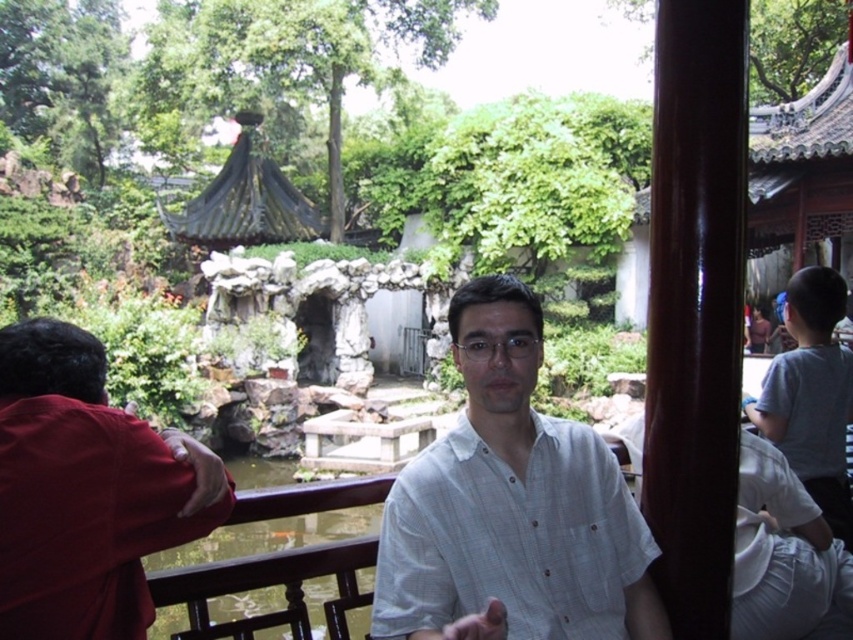
Does point (392, 563) lie in front of point (838, 448)?

Yes, point (392, 563) is closer to viewer.

Is white textured shirt at center to the right of gray cotton shirt at right from the viewer's perspective?

In fact, white textured shirt at center is to the left of gray cotton shirt at right.

The image size is (853, 640). Find the location of `white textured shirt at center`. white textured shirt at center is located at coordinates point(511,506).

Does point (277, 490) come behind point (209, 230)?

No, it is in front of (209, 230).

Measure the distance from transparent glass pond at center to dark gray stone gazebo at upper left.

transparent glass pond at center and dark gray stone gazebo at upper left are 44.15 meters apart.

Identify the location of transparent glass pond at center. click(x=267, y=586).

Can you confirm if gray cotton shirt at right is taller than dark gray stone gazebo at upper left?

Incorrect, gray cotton shirt at right's height is not larger of dark gray stone gazebo at upper left's.

Between point (755, 403) and point (244, 220), which one is positioned in front?

Point (755, 403)

At what (x,y) coordinates should I click in order to perform the action: click on gray cotton shirt at right. Please return your answer as a coordinate pair (x, y). The image size is (853, 640). Looking at the image, I should click on [x=811, y=396].